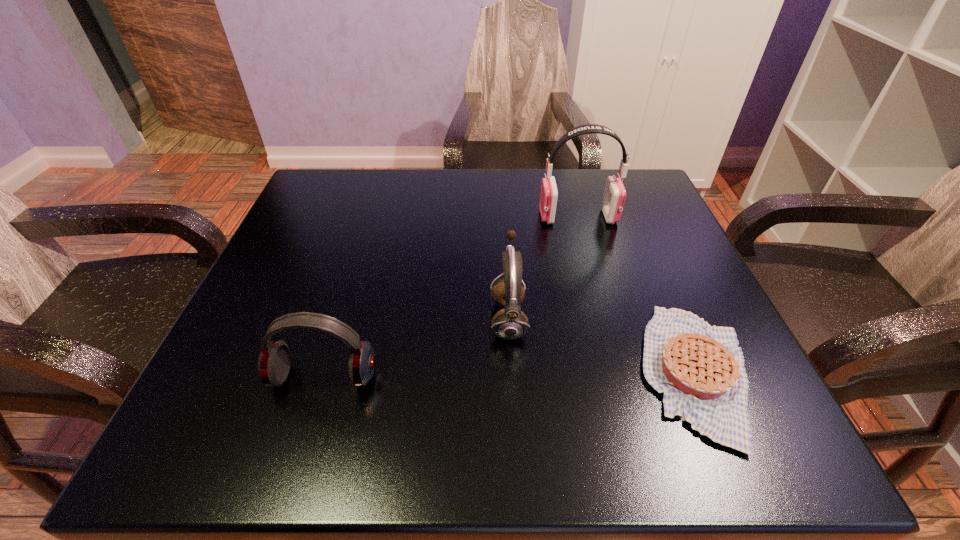
Locate an element on the screen. object present at the far right corner is located at coordinates (614, 195).

Where is `object located in the near right corner section of the desktop`? This screenshot has width=960, height=540. object located in the near right corner section of the desktop is located at coordinates 700,369.

The image size is (960, 540). In order to click on free spot at the far edge of the desktop in this screenshot , I will do `click(389, 169)`.

At what (x,y) coordinates should I click in order to perform the action: click on vacant area at the near edge of the desktop. Please return your answer as a coordinate pair (x, y). Looking at the image, I should click on (420, 412).

This screenshot has height=540, width=960. I want to click on vacant space at the left edge of the desktop, so click(265, 306).

Identify the location of free space at the right edge of the desktop. 718,312.

Identify the location of vacant region at the far left corner. (358, 187).

Where is `vacant region at the far right corner`? The image size is (960, 540). vacant region at the far right corner is located at coordinates 636,195.

The image size is (960, 540). What are the coordinates of `vacant space at the near right corner of the desktop` in the screenshot? It's located at (721, 445).

This screenshot has width=960, height=540. Find the location of `free space between the shortest object and the tallest object`. free space between the shortest object and the tallest object is located at coordinates (637, 295).